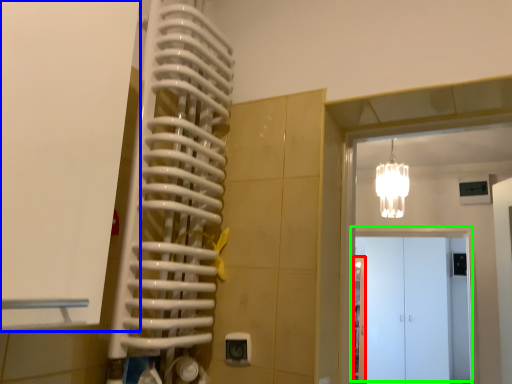
Question: Based on their relative distances, which object is nearer to door (highlighted by a red box)? Choose from door (highlighted by a blue box) and door (highlighted by a green box).

Choices:
 (A) door
 (B) door

Answer: (B)